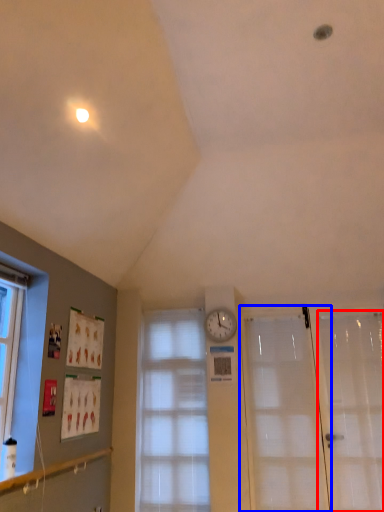
Question: Among these objects, which one is farthest to the camera, screen door (highlighted by a red box) or door (highlighted by a blue box)?

Choices:
 (A) screen door
 (B) door

Answer: (B)